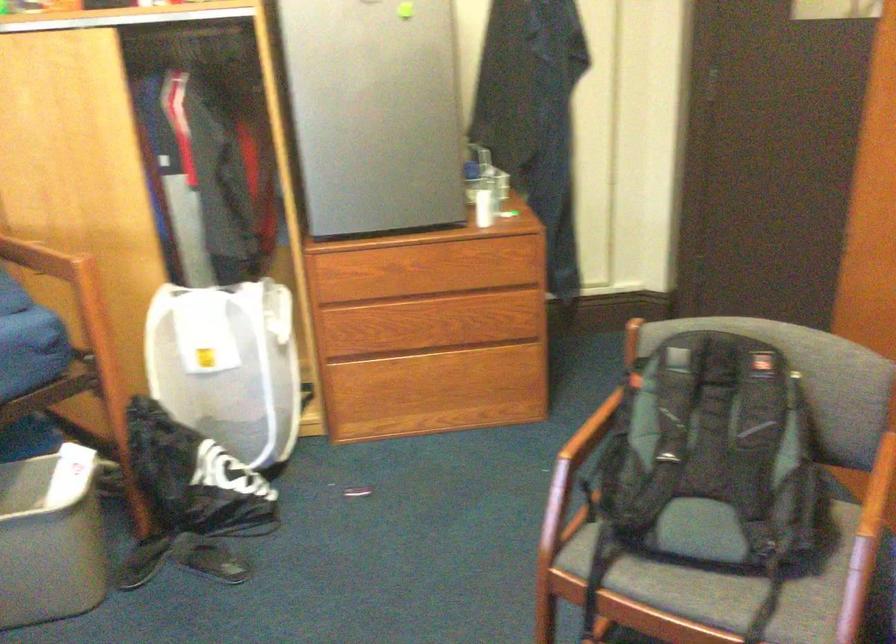
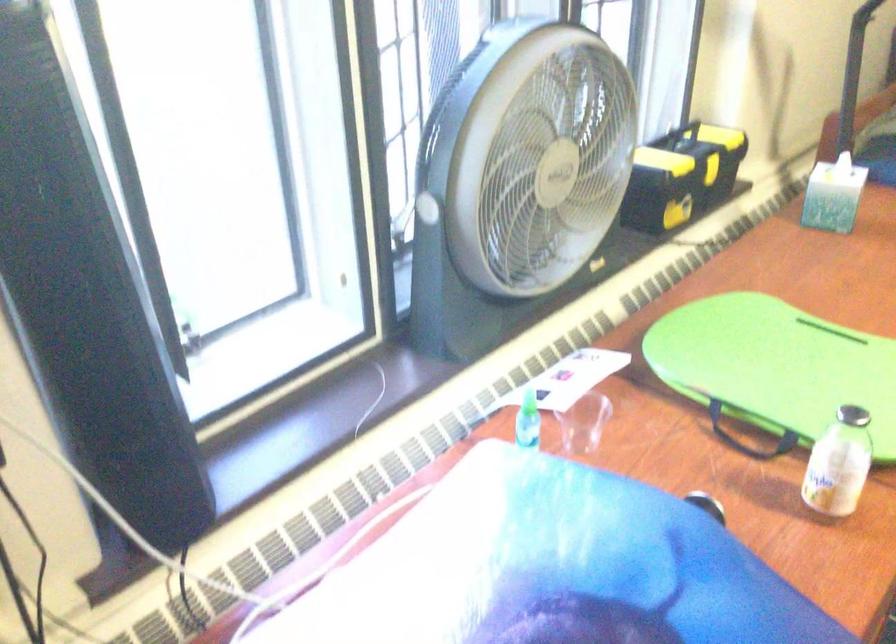
From the picture: The images are taken continuously from a first-person perspective. In which direction is your viewpoint rotating?

The camera rotated toward left-down.